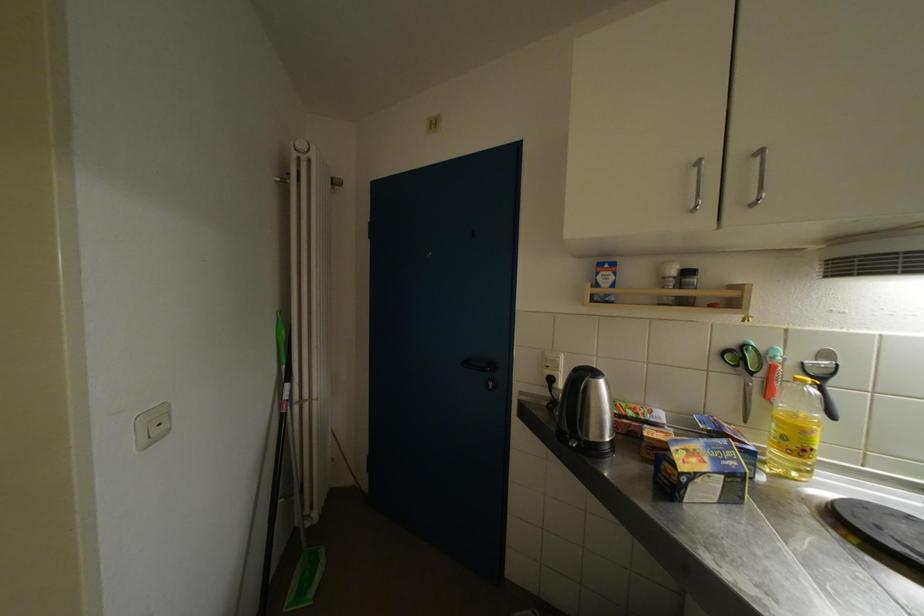
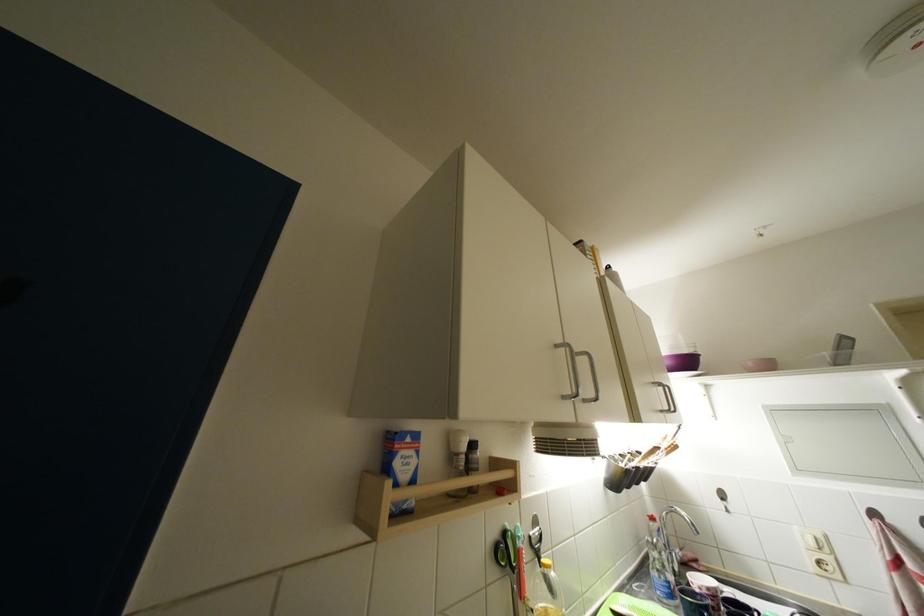
Find the pixel in the second image that matches pixel 689 284 in the first image.

(478, 460)